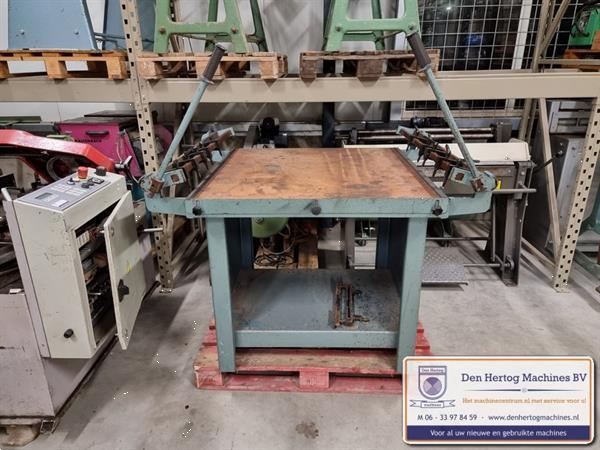
At what (x,y) coordinates should I click in order to perform the action: click on den. Please return your answer as a coordinate pair (x, y). This screenshot has width=600, height=450. Looking at the image, I should click on (478, 377).